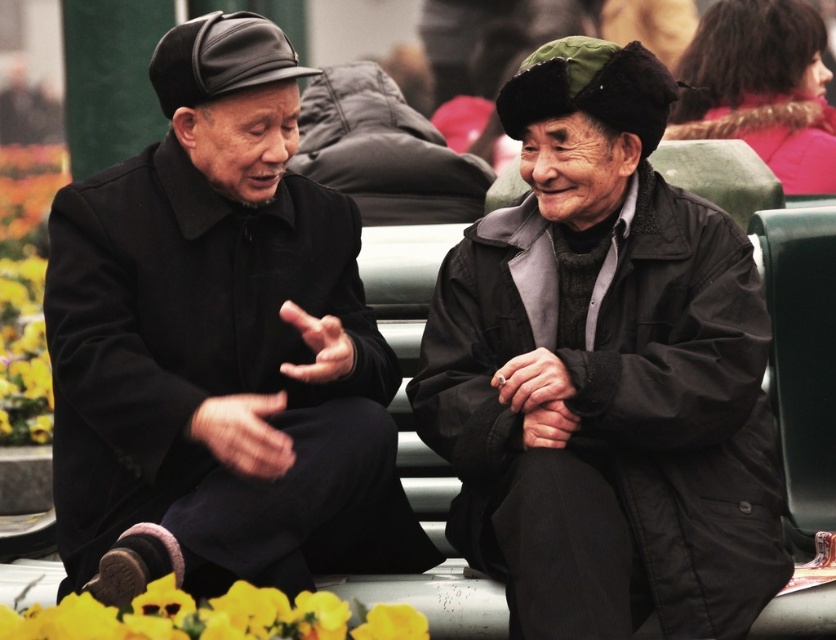
Which of these two, dark gray woolen jacket at center or yellow fabric flower at lower left, stands taller?

With more height is dark gray woolen jacket at center.

Which is behind, point (755, 394) or point (345, 616)?

The point (755, 394) is behind.

Where is `dark gray woolen jacket at center`? dark gray woolen jacket at center is located at coordinates (604, 372).

Can you confirm if dark gray woolen jacket at center is positioned to the right of velvet pink coat at upper right?

No, dark gray woolen jacket at center is not to the right of velvet pink coat at upper right.

This screenshot has width=836, height=640. Describe the element at coordinates (604, 372) in the screenshot. I see `dark gray woolen jacket at center` at that location.

Between point (732, 369) and point (752, 120), which one is positioned behind?

The point (752, 120) is behind.

Identify the location of dark gray woolen jacket at center. This screenshot has height=640, width=836. coord(604,372).

Can you confirm if dark gray woolen jacket at center is wider than matte black coat at left?

Incorrect, dark gray woolen jacket at center's width does not surpass matte black coat at left's.

Looking at this image, is dark gray woolen jacket at center taller than matte black coat at left?

Yes, dark gray woolen jacket at center is taller than matte black coat at left.

This screenshot has height=640, width=836. Describe the element at coordinates (604, 372) in the screenshot. I see `dark gray woolen jacket at center` at that location.

The image size is (836, 640). Identify the location of dark gray woolen jacket at center. (604, 372).